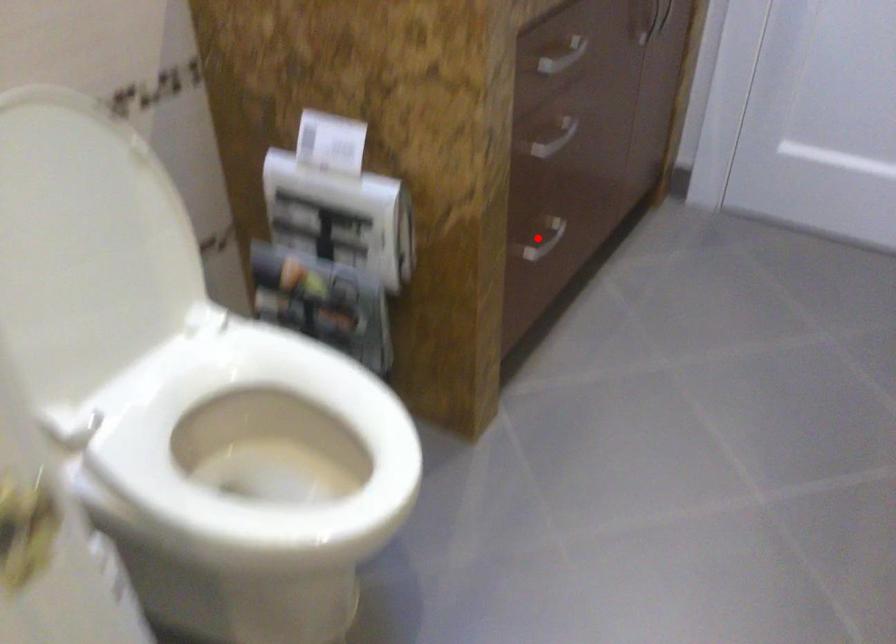
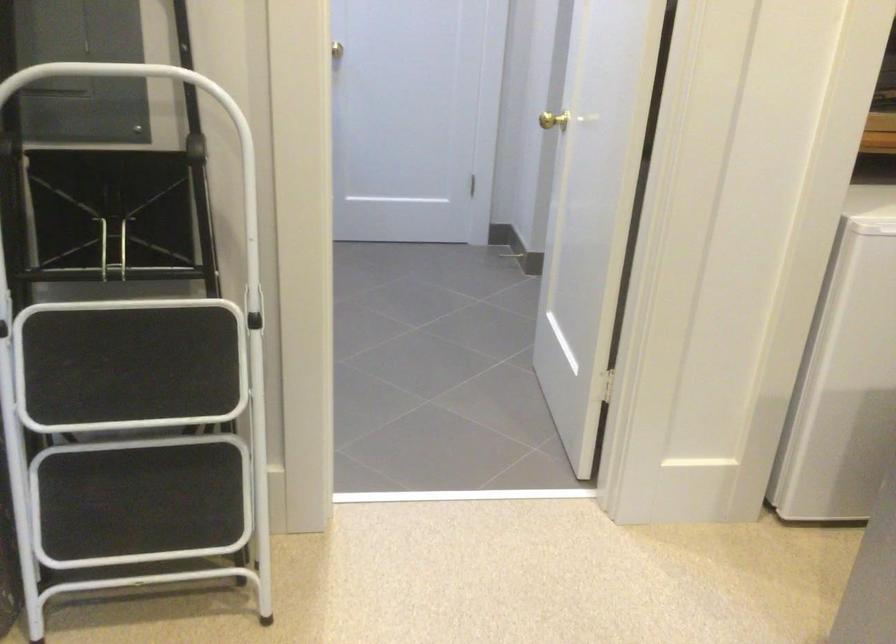
Question: I am providing you with two images of the same scene from different viewpoints. A red point is marked on the first image. Is the red point's position out of view in image 2?

Choices:
 (A) Yes
 (B) No

Answer: (A)